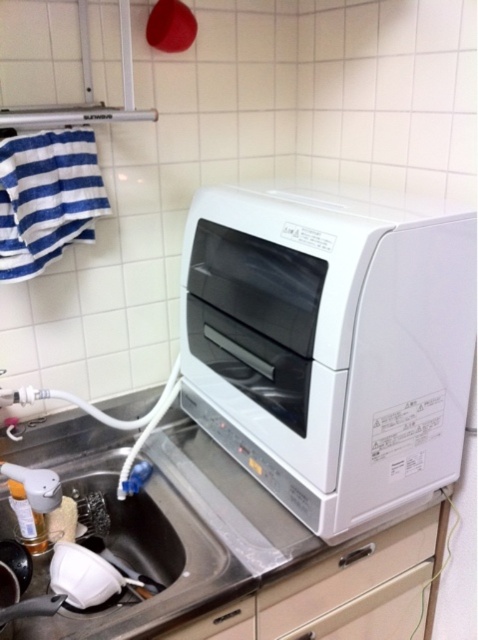
Who is more forward, (284, 340) or (142, 532)?

Point (284, 340) is in front.

Does point (433, 404) come closer to viewer compared to point (218, 460)?

Yes.

This screenshot has height=640, width=478. In order to click on white glossy microwave at center in this screenshot , I will do `click(329, 344)`.

Does white plastic drawer at center have a greater width compared to matte white drawer at lower center?

Correct, the width of white plastic drawer at center exceeds that of matte white drawer at lower center.

Looking at this image, is white plastic drawer at center smaller than matte white drawer at lower center?

No.

Is point (349, 554) positioned in front of point (218, 632)?

No.

You are a GUI agent. You are given a task and a screenshot of the screen. Output one action in this format:
    pyautogui.click(x=<x>, y=<y>)
    Task: Click on the white plastic drawer at center
    
    Given the screenshot: What is the action you would take?
    356,588

Between white glossy microwave at center and stainless steel sink at lower left, which one is positioned lower?

Positioned lower is stainless steel sink at lower left.

Between point (251, 268) and point (138, 627), which one is positioned in front?

Point (138, 627) is in front.

Identify the location of white glossy microwave at center. The image size is (478, 640). (329, 344).